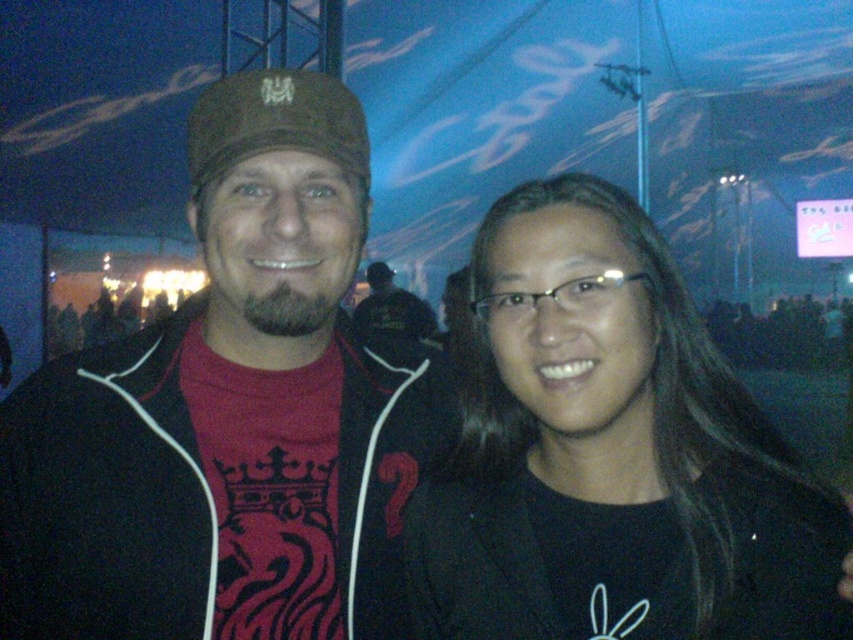
Question: Does matte black jacket at center have a larger size compared to black matte glasses at center?

Choices:
 (A) yes
 (B) no

Answer: (A)

Question: Does matte black jacket at center have a larger size compared to black matte glasses at center?

Choices:
 (A) no
 (B) yes

Answer: (B)

Question: Among these objects, which one is farthest from the camera?

Choices:
 (A) black matte glasses at center
 (B) matte black jacket at center

Answer: (B)

Question: Which point appears farthest from the camera in this image?

Choices:
 (A) (645, 314)
 (B) (125, 531)

Answer: (B)

Question: Observing the image, what is the correct spatial positioning of matte black jacket at center in reference to black matte glasses at center?

Choices:
 (A) left
 (B) right

Answer: (A)